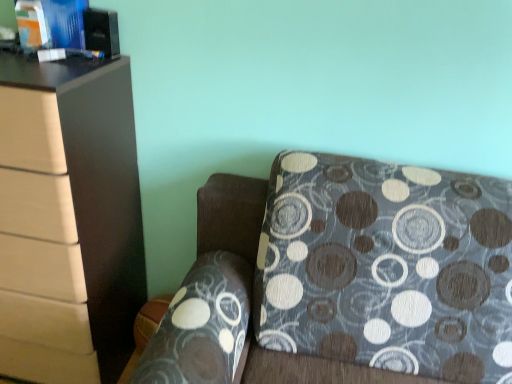
Where is `vacant area that is in front of blue glossy book at upper left, the 2th book positioned from the left`? This screenshot has width=512, height=384. vacant area that is in front of blue glossy book at upper left, the 2th book positioned from the left is located at coordinates (39, 66).